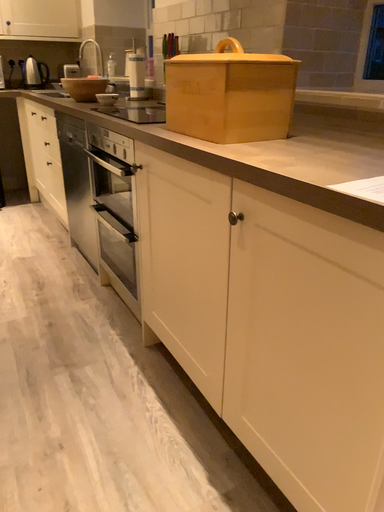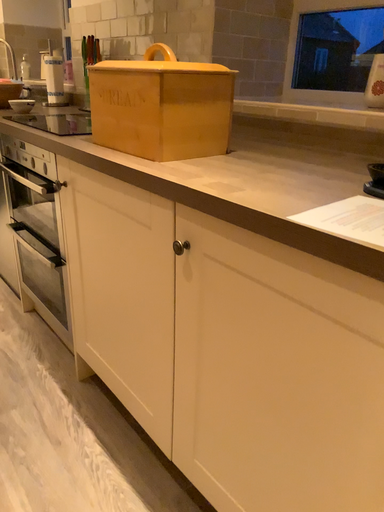
Question: How did the camera likely rotate when shooting the video?

Choices:
 (A) rotated left
 (B) rotated right

Answer: (B)